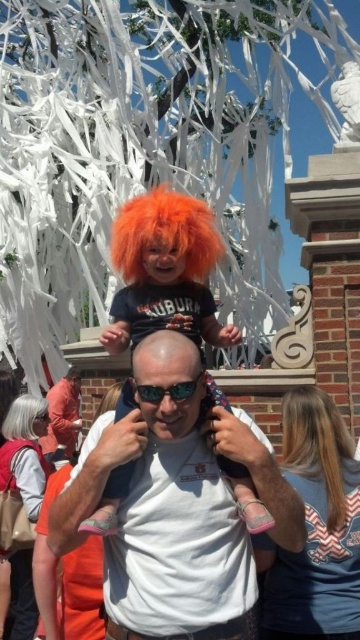
You are standing in the outdoor scene and want to know the distance to the point marked at coordinates (206, 208). Can you estimate how far it is from where you are standing?

The point at coordinates (206, 208) is 40.39 meters away from the viewer.

You are a photographer trying to capture a closeup of the orange synthetic wig at center and the blonde silky hair at upper right. Which of the two has a wider appearance in the photo?

The orange synthetic wig at center has a wider appearance in the photo because its width is larger than the blonde silky hair at upper right.

You are a photographer trying to focus on both the blonde silky hair at upper right and the bald head at center. Which object should you adjust your camera focus on first if you want to capture both in the same frame?

You should focus on the bald head at center first because the blonde silky hair at upper right is closer to the viewer and will require adjusting the focus to ensure both are in the same frame.